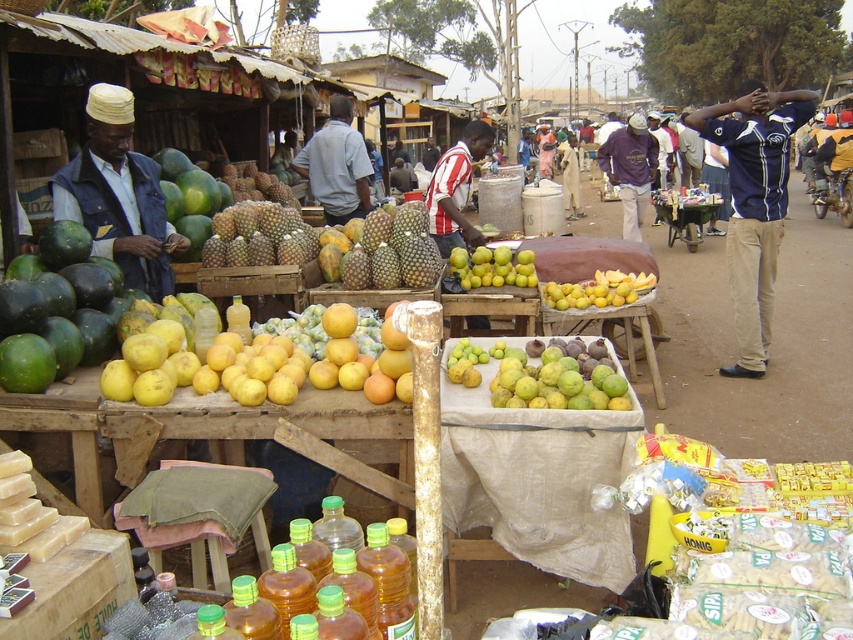
Question: Among these points, which one is farthest from the camera?

Choices:
 (A) (738, 353)
 (B) (614, 154)
 (C) (405, 218)
 (D) (456, 257)

Answer: (B)

Question: Can you confirm if green matte pineapple at center is positioned above purple cotton shirt at center?

Choices:
 (A) no
 (B) yes

Answer: (A)

Question: Does green matte pineapple at center have a smaller size compared to yellow matte mangoes at center?

Choices:
 (A) yes
 (B) no

Answer: (B)

Question: Which object is closer to the camera taking this photo?

Choices:
 (A) light blue shirt at center
 (B) blue jersey at center
 (C) yellow matte quince at center
 (D) purple cotton shirt at center

Answer: (C)

Question: Is blue jersey at center bigger than yellow matte quince at center?

Choices:
 (A) yes
 (B) no

Answer: (A)

Question: Which object is positioned closest to the blue jersey at center?

Choices:
 (A) purple cotton shirt at center
 (B) matte blue vest at left
 (C) yellow matte quince at center
 (D) green matte pineapple at center

Answer: (A)